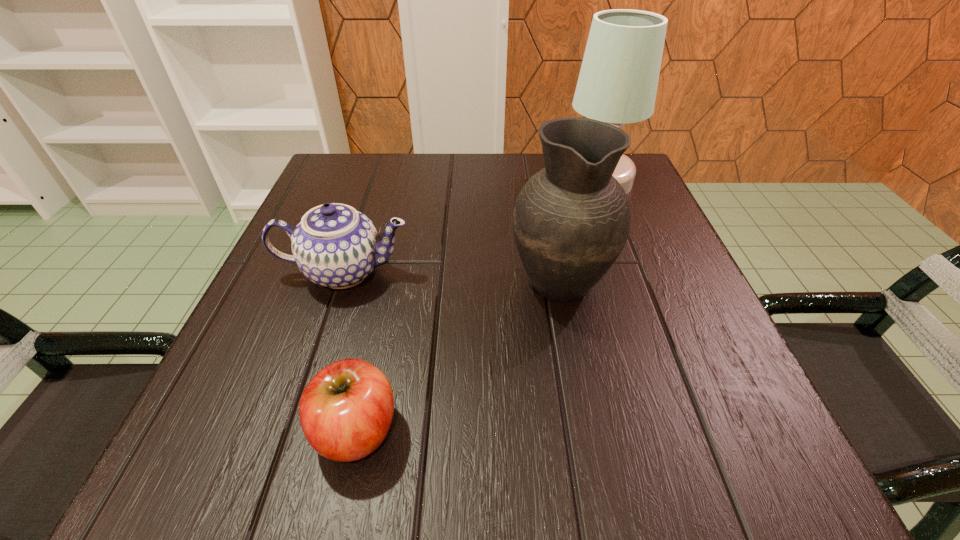
Locate an element on the screen. This screenshot has height=540, width=960. vacant space located on the side of the pitcher with the handle is located at coordinates (543, 194).

Identify the location of blank space located on the side of the pitcher with the handle. (550, 229).

Identify the location of vacant space located 0.190m at the spout of the second shortest object. (301, 401).

Where is `vacant space located 0.340m on the right of the nearest object`? The height and width of the screenshot is (540, 960). vacant space located 0.340m on the right of the nearest object is located at coordinates pos(662,430).

At what (x,y) coordinates should I click in order to perform the action: click on object that is positioned at the far edge. Please return your answer as a coordinate pair (x, y). The image size is (960, 540). Looking at the image, I should click on (618, 80).

Find the location of a particular element. This screenshot has width=960, height=540. object positioned at the near edge is located at coordinates pyautogui.click(x=346, y=410).

Locate an element on the screen. The image size is (960, 540). chinaware that is at the left edge is located at coordinates (335, 246).

I want to click on apple at the left edge, so click(x=346, y=410).

What are the coordinates of `lampshade that is at the right edge` in the screenshot? It's located at (618, 80).

In order to click on pitcher at the right edge in this screenshot , I will do `click(571, 220)`.